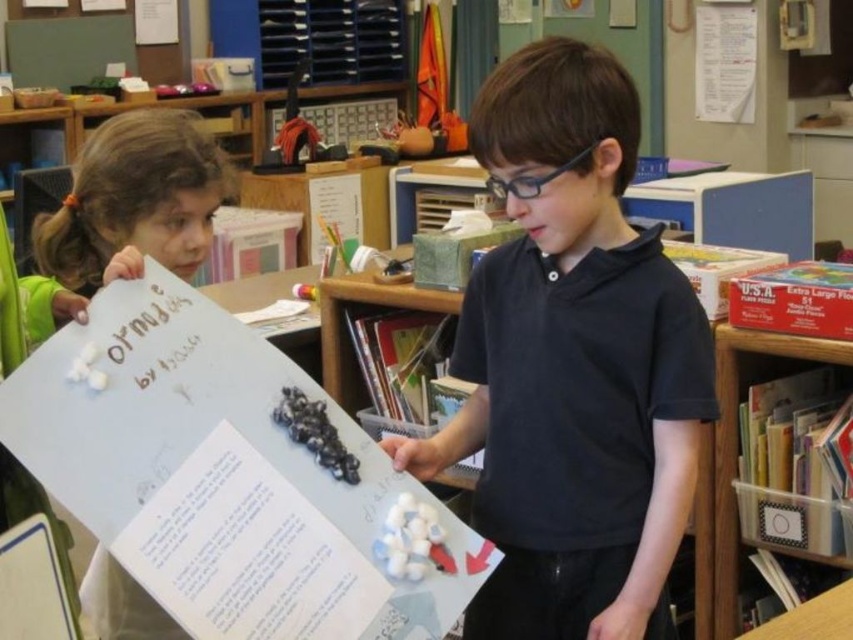
Who is positioned more to the left, black matte shirt at center or clear plastic bin at lower right?

From the viewer's perspective, black matte shirt at center appears more on the left side.

Is point (619, 452) more distant than point (726, 324)?

That is False.

Which is behind, point (486, 470) or point (715, 332)?

Positioned behind is point (715, 332).

This screenshot has height=640, width=853. I want to click on black matte shirt at center, so click(572, 364).